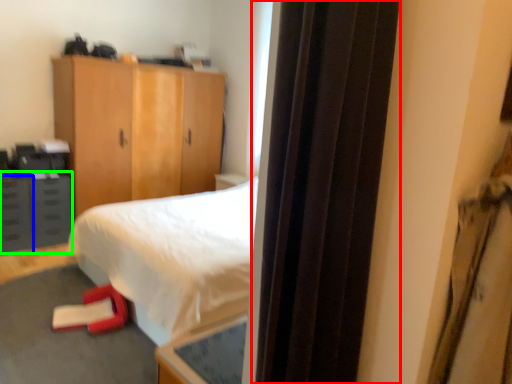
Question: Estimate the real-world distances between objects in this image. Which object is farther from screen door (highlighted by a red box), drawer (highlighted by a blue box) or cabinetry (highlighted by a green box)?

Choices:
 (A) drawer
 (B) cabinetry

Answer: (A)